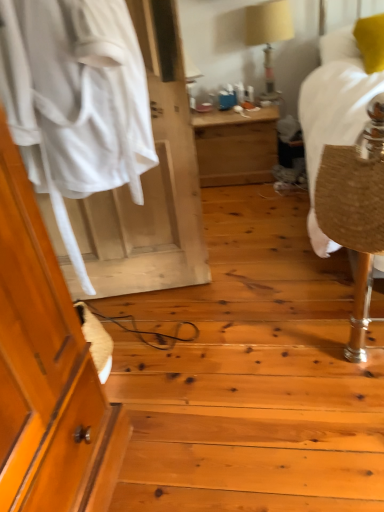
Question: Does white fabric at left have a larger size compared to beige fabric lampshade at upper center?

Choices:
 (A) yes
 (B) no

Answer: (A)

Question: Is white fabric at left wider than beige fabric lampshade at upper center?

Choices:
 (A) yes
 (B) no

Answer: (B)

Question: Can you confirm if white fabric at left is thinner than beige fabric lampshade at upper center?

Choices:
 (A) no
 (B) yes

Answer: (B)

Question: Does white fabric at left have a lesser height compared to beige fabric lampshade at upper center?

Choices:
 (A) yes
 (B) no

Answer: (B)

Question: Considering the relative positions of white fabric at left and beige fabric lampshade at upper center in the image provided, is white fabric at left to the left of beige fabric lampshade at upper center from the viewer's perspective?

Choices:
 (A) no
 (B) yes

Answer: (B)

Question: Is there a large distance between white fabric at left and beige fabric lampshade at upper center?

Choices:
 (A) yes
 (B) no

Answer: (A)

Question: Could you tell me if wooden desk at center is turned towards beige fabric lampshade at upper center?

Choices:
 (A) no
 (B) yes

Answer: (A)

Question: From the image's perspective, does wooden desk at center appear lower than beige fabric lampshade at upper center?

Choices:
 (A) no
 (B) yes

Answer: (B)

Question: From the image's perspective, is wooden desk at center on beige fabric lampshade at upper center?

Choices:
 (A) yes
 (B) no

Answer: (B)

Question: Are wooden desk at center and beige fabric lampshade at upper center far apart?

Choices:
 (A) no
 (B) yes

Answer: (A)

Question: From a real-world perspective, does wooden desk at center sit lower than beige fabric lampshade at upper center?

Choices:
 (A) yes
 (B) no

Answer: (A)

Question: Does wooden desk at center have a lesser width compared to beige fabric lampshade at upper center?

Choices:
 (A) no
 (B) yes

Answer: (A)

Question: Is white fabric at left positioned beyond the bounds of wooden desk at center?

Choices:
 (A) no
 (B) yes

Answer: (B)